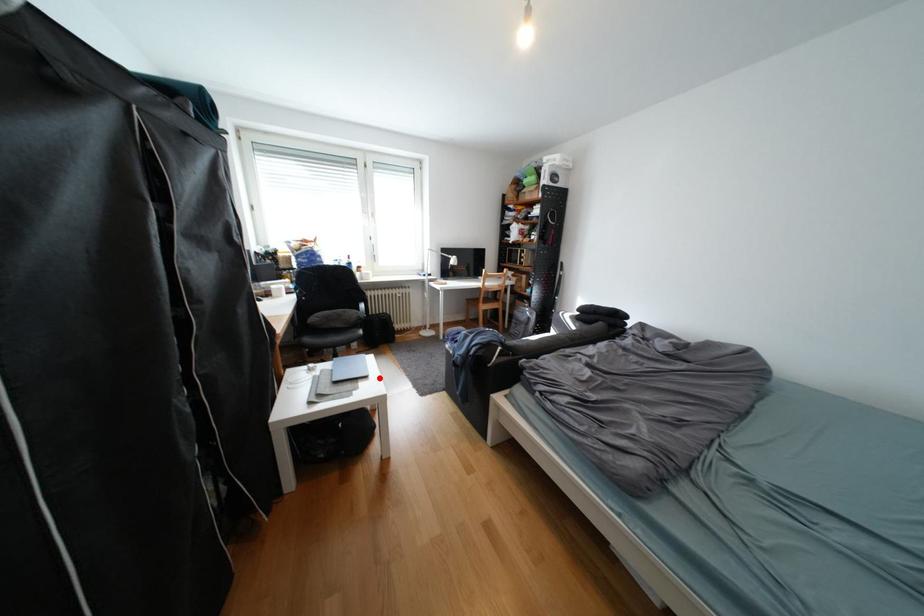
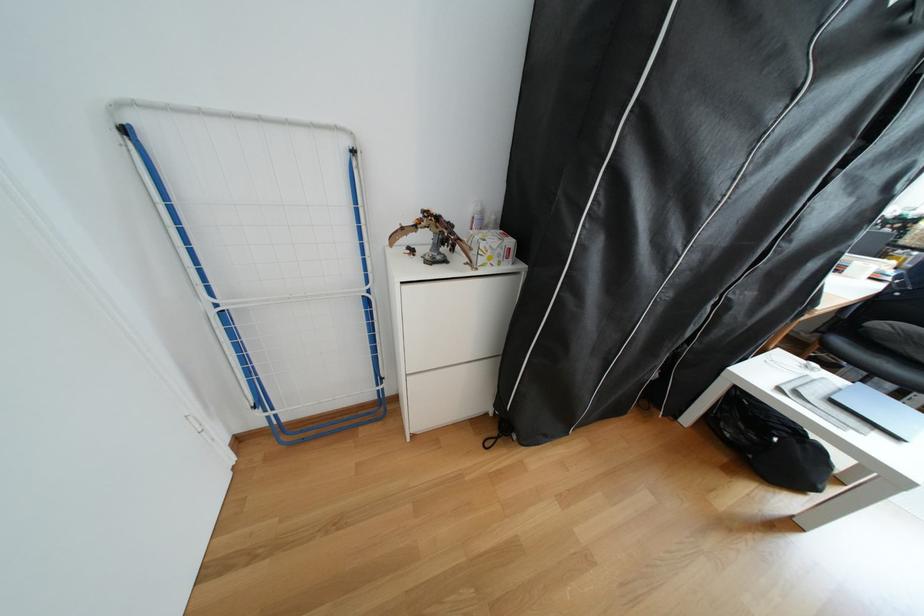
Question: I am providing you with two images of the same scene from different viewpoints. Image1 has a red point marked. In image2, the corresponding 3D location appears at what relative position? Reply with the corresponding letter.

Choices:
 (A) Closer
 (B) Farther

Answer: (B)